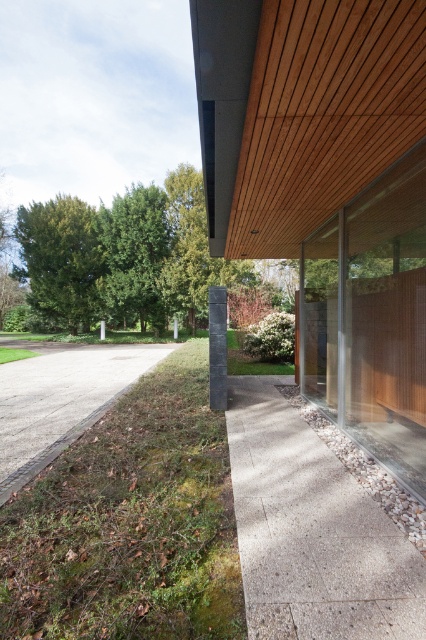
You are standing at the center of the image and want to walk to the concrete textured driveway at lower right. Which direction should you move relative to the gravel driveway at lower left?

The concrete textured driveway at lower right is below the gravel driveway at lower left, so you should move downward from the gravel driveway at lower left to reach the concrete textured driveway at lower right.

You are a delivery person arriving at this location and need to park your vehicle. The gravel driveway at lower left and the concrete textured driveway at lower right are both available. Which driveway has enough space to accommodate a standard delivery truck that requires a 10 meter long parking area?

The gravel driveway at lower left has a larger size than the concrete textured driveway at lower right, so it is more likely to have enough space for the delivery truck requiring a 10 meter long parking area.